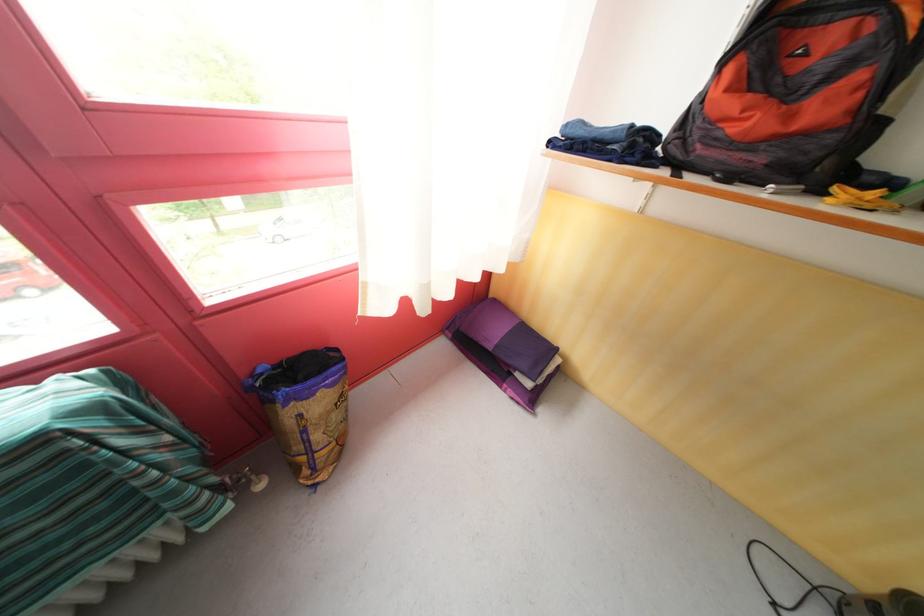
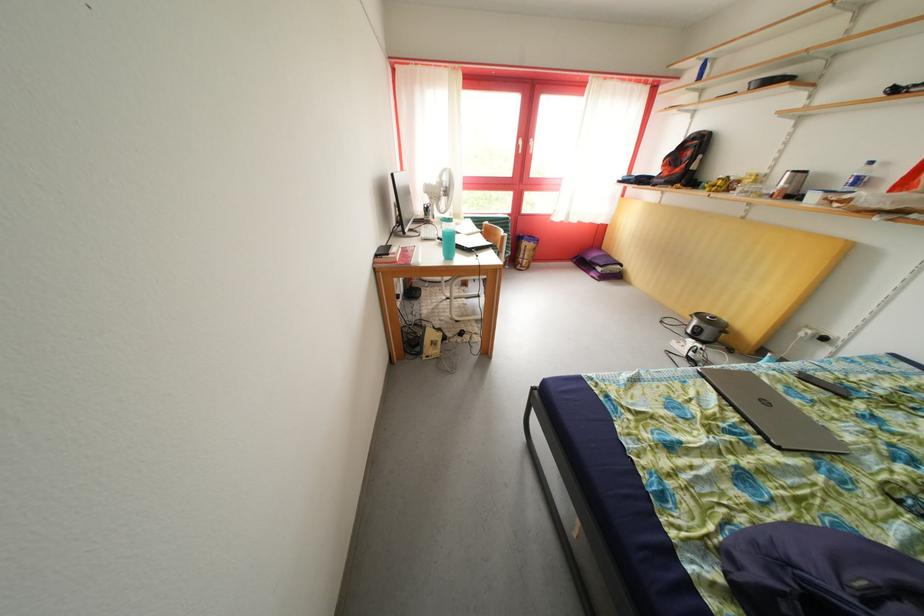
In the second image, find the point that corresponds to the point at 536,391 in the first image.

(608, 275)